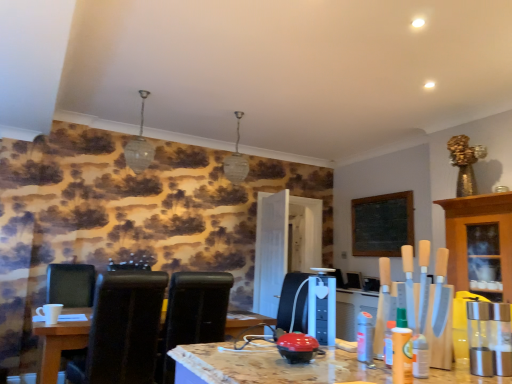
Identify the location of wooden cabinet at right. The image size is (512, 384). (480, 243).

Describe the element at coordinates (122, 330) in the screenshot. This screenshot has height=384, width=512. I see `black leather chair at left, arranged as the 2th chair when viewed from the left` at that location.

What is the approximate width of black leather chair at left, arranged as the 2th chair when viewed from the left?

black leather chair at left, arranged as the 2th chair when viewed from the left, is 25.21 inches wide.

Image resolution: width=512 pixels, height=384 pixels. Find the location of `wooden table at lower left`. wooden table at lower left is located at coordinates (60, 342).

Describe the element at coordinates (71, 284) in the screenshot. I see `black leather chair at lower left, the third chair from the right` at that location.

How much space does black leather chair at center, placed as the 1th chair when sorted from right to left, occupy vertically?

32.97 inches.

You are a GUI agent. You are given a task and a screenshot of the screen. Output one action in this format:
    pyautogui.click(x=<x>, y=<y>)
    Task: Click on the black leather chair at center, placed as the 1th chair when sorted from right to left
    The height and width of the screenshot is (384, 512).
    Given the screenshot: What is the action you would take?
    pyautogui.click(x=192, y=315)

The height and width of the screenshot is (384, 512). What are the coordinates of `wooden cabinet at right` in the screenshot? It's located at (480, 243).

Would you say black leather chair at lower left, the third chair from the right, is a long distance from black leather chair at left, placed as the 2th chair when sorted from right to left?

Yes, black leather chair at lower left, the third chair from the right, and black leather chair at left, placed as the 2th chair when sorted from right to left, are located far from each other.

Locate an element on the screen. Image resolution: width=512 pixels, height=384 pixels. chair that is the 2nd one below the black leather chair at left, arranged as the 2th chair when viewed from the left (from a real-world perspective) is located at coordinates (71, 284).

From the image's perspective, relative to black leather chair at left, placed as the 2th chair when sorted from right to left, is black leather chair at lower left, the 1th chair from the left, above or below?

black leather chair at lower left, the 1th chair from the left, is situated lower than black leather chair at left, placed as the 2th chair when sorted from right to left, in the image.

From a real-world perspective, is black leather chair at lower left, the third chair from the right, located higher than black leather chair at left, arranged as the 2th chair when viewed from the left?

Incorrect, from a real-world perspective, black leather chair at lower left, the third chair from the right, is lower than black leather chair at left, arranged as the 2th chair when viewed from the left.

Who is shorter, wooden cabinet at right or wooden table at lower left?

wooden table at lower left.

Considering the relative sizes of wooden cabinet at right and wooden table at lower left in the image provided, is wooden cabinet at right bigger than wooden table at lower left?

Incorrect, wooden cabinet at right is not larger than wooden table at lower left.

Is wooden cabinet at right not inside wooden table at lower left?

Yes, wooden cabinet at right is outside of wooden table at lower left.

Does wooden cabinet at right turn towards wooden table at lower left?

No, wooden cabinet at right is not turned towards wooden table at lower left.

Is black leather chair at center, placed as the 1th chair when sorted from right to left, turned away from black leather chair at lower left, the 1th chair from the left?

No, black leather chair at center, placed as the 1th chair when sorted from right to left,'s orientation is not away from black leather chair at lower left, the 1th chair from the left.

Can you tell me how much black leather chair at center, placed as the 1th chair when sorted from right to left, and black leather chair at lower left, the 1th chair from the left, differ in facing direction?

The facing directions of black leather chair at center, placed as the 1th chair when sorted from right to left, and black leather chair at lower left, the 1th chair from the left, are 176 degrees apart.

Which of these two, black leather chair at center, placed as the 3th chair when sorted from left to right, or black leather chair at lower left, the third chair from the right, is thinner?

Thinner between the two is black leather chair at center, placed as the 3th chair when sorted from left to right.

In the scene shown: From a real-world perspective, is wooden cabinet at right positioned under black leather chair at center, placed as the 1th chair when sorted from right to left, based on gravity?

No, from a real-world perspective, wooden cabinet at right is not beneath black leather chair at center, placed as the 1th chair when sorted from right to left.

Do you think wooden cabinet at right is within black leather chair at center, placed as the 3th chair when sorted from left to right, or outside of it?

wooden cabinet at right is not inside black leather chair at center, placed as the 3th chair when sorted from left to right, it's outside.

Considering the sizes of objects wooden cabinet at right and black leather chair at center, placed as the 3th chair when sorted from left to right, in the image provided, who is smaller, wooden cabinet at right or black leather chair at center, placed as the 3th chair when sorted from left to right,?

wooden cabinet at right is smaller.

From the image's perspective, would you say wooden cabinet at right is positioned over black leather chair at center, placed as the 3th chair when sorted from left to right?

Yes, from the image's perspective, wooden cabinet at right is over black leather chair at center, placed as the 3th chair when sorted from left to right.

Starting from the black leather chair at lower left, the third chair from the right, which chair is the 2nd one to the right? Please provide its 2D coordinates.

[(192, 315)]

Which is more to the right, black leather chair at lower left, the 1th chair from the left, or black leather chair at center, placed as the 1th chair when sorted from right to left?

Positioned to the right is black leather chair at center, placed as the 1th chair when sorted from right to left.

Measure the distance between black leather chair at lower left, the third chair from the right, and black leather chair at center, placed as the 1th chair when sorted from right to left.

black leather chair at lower left, the third chair from the right, is 1.28 meters away from black leather chair at center, placed as the 1th chair when sorted from right to left.

Is black leather chair at lower left, the third chair from the right, oriented away from black leather chair at center, placed as the 3th chair when sorted from left to right?

→ No, black leather chair at center, placed as the 3th chair when sorted from left to right, is not at the back of black leather chair at lower left, the third chair from the right.

Is black leather chair at left, arranged as the 2th chair when viewed from the left, wider than wooden table at lower left?

In fact, black leather chair at left, arranged as the 2th chair when viewed from the left, might be narrower than wooden table at lower left.

Which is more to the right, black leather chair at left, arranged as the 2th chair when viewed from the left, or wooden table at lower left?

Positioned to the right is wooden table at lower left.

Relative to wooden table at lower left, is black leather chair at left, placed as the 2th chair when sorted from right to left, in front or behind?

A: black leather chair at left, placed as the 2th chair when sorted from right to left, is positioned closer to the viewer than wooden table at lower left.

In the scene shown: From a real-world perspective, is black leather chair at left, placed as the 2th chair when sorted from right to left, physically located above or below wooden table at lower left?

black leather chair at left, placed as the 2th chair when sorted from right to left, is situated higher than wooden table at lower left in the real world.

Would you consider black leather chair at lower left, the third chair from the right, to be distant from wooden table at lower left?

No.

In terms of height, does black leather chair at lower left, the 1th chair from the left, look taller or shorter compared to wooden table at lower left?

In the image, black leather chair at lower left, the 1th chair from the left, appears to be taller than wooden table at lower left.

Can you confirm if black leather chair at lower left, the 1th chair from the left, is positioned to the left of wooden table at lower left?

Correct, you'll find black leather chair at lower left, the 1th chair from the left, to the left of wooden table at lower left.

From the picture: Which is farther from the camera, (51, 295) or (75, 335)?

The point (51, 295) is farther from the camera.

Where is `the 1st chair to the right when counting from the black leather chair at lower left, the third chair from the right`? The image size is (512, 384). the 1st chair to the right when counting from the black leather chair at lower left, the third chair from the right is located at coordinates (122, 330).

Where is `table below the wooden cabinet at right (from a real-world perspective)`? The width and height of the screenshot is (512, 384). table below the wooden cabinet at right (from a real-world perspective) is located at coordinates (60, 342).

Based on their spatial positions, is black leather chair at center, placed as the 1th chair when sorted from right to left, or wooden table at lower left closer to wooden cabinet at right?

Among the two, black leather chair at center, placed as the 1th chair when sorted from right to left, is located nearer to wooden cabinet at right.

Based on their spatial positions, is wooden table at lower left or black leather chair at left, placed as the 2th chair when sorted from right to left, closer to wooden cabinet at right?

The object closer to wooden cabinet at right is black leather chair at left, placed as the 2th chair when sorted from right to left.

In the scene shown: When comparing their distances from wooden table at lower left, does black leather chair at center, placed as the 3th chair when sorted from left to right, or black leather chair at left, arranged as the 2th chair when viewed from the left, seem further?

black leather chair at center, placed as the 3th chair when sorted from left to right, is further to wooden table at lower left.

Looking at the image, which one is located closer to black leather chair at center, placed as the 1th chair when sorted from right to left, wooden table at lower left or black leather chair at lower left, the 1th chair from the left?

The object closer to black leather chair at center, placed as the 1th chair when sorted from right to left, is wooden table at lower left.

Looking at the image, which one is located further to wooden table at lower left, black leather chair at left, placed as the 2th chair when sorted from right to left, or black leather chair at lower left, the 1th chair from the left?

Among the two, black leather chair at lower left, the 1th chair from the left, is located further to wooden table at lower left.

Looking at the image, which one is located closer to wooden cabinet at right, wooden table at lower left or black leather chair at lower left, the third chair from the right?

wooden table at lower left is positioned closer to the anchor wooden cabinet at right.

From the image, which object appears to be nearer to wooden cabinet at right, black leather chair at lower left, the third chair from the right, or black leather chair at left, placed as the 2th chair when sorted from right to left?

→ black leather chair at left, placed as the 2th chair when sorted from right to left, is closer to wooden cabinet at right.

Estimate the real-world distances between objects in this image. Which object is closer to black leather chair at center, placed as the 1th chair when sorted from right to left, wooden table at lower left or wooden cabinet at right?

wooden table at lower left is positioned closer to the anchor black leather chair at center, placed as the 1th chair when sorted from right to left.

Locate an element on the screen. chair between wooden table at lower left and wooden cabinet at right from left to right is located at coordinates (192, 315).

The width and height of the screenshot is (512, 384). Find the location of `table located between black leather chair at left, placed as the 2th chair when sorted from right to left, and black leather chair at lower left, the 1th chair from the left, in the depth direction`. table located between black leather chair at left, placed as the 2th chair when sorted from right to left, and black leather chair at lower left, the 1th chair from the left, in the depth direction is located at coordinates (60, 342).

The image size is (512, 384). What are the coordinates of `chair between black leather chair at lower left, the 1th chair from the left, and black leather chair at center, placed as the 3th chair when sorted from left to right, from left to right` in the screenshot? It's located at (122, 330).

Find the location of `table situated between black leather chair at left, arranged as the 2th chair when viewed from the left, and black leather chair at center, placed as the 3th chair when sorted from left to right, from left to right`. table situated between black leather chair at left, arranged as the 2th chair when viewed from the left, and black leather chair at center, placed as the 3th chair when sorted from left to right, from left to right is located at coordinates (60, 342).